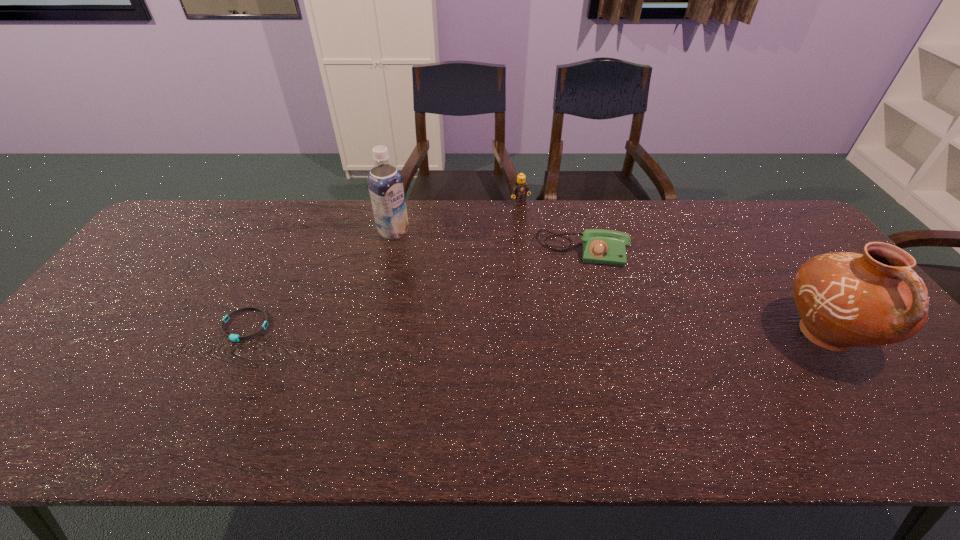
Find the location of a particular element. This screenshot has width=960, height=540. object that is at the near edge is located at coordinates (845, 299).

Where is `object that is at the right edge`? The image size is (960, 540). object that is at the right edge is located at coordinates (845, 299).

Find the location of `object located in the near right corner section of the desktop`. object located in the near right corner section of the desktop is located at coordinates (845, 299).

In the image, there is a desktop. At what (x,y) coordinates should I click in order to perform the action: click on vacant region at the far edge. Please return your answer as a coordinate pair (x, y). The image size is (960, 540). Looking at the image, I should click on (610, 227).

Where is `blank space at the near edge of the desktop`? blank space at the near edge of the desktop is located at coordinates (510, 381).

Where is `vacant area at the left edge of the desktop`? The image size is (960, 540). vacant area at the left edge of the desktop is located at coordinates (63, 348).

Locate an element on the screen. vacant space that is in between the third shortest object and the leftmost object is located at coordinates (383, 265).

At what (x,y) coordinates should I click in order to perform the action: click on free area in between the third shortest object and the rightmost object. Please return your answer as a coordinate pair (x, y). Looking at the image, I should click on (673, 269).

Locate an element on the screen. blank region between the telephone and the pottery is located at coordinates (704, 293).

What are the coordinates of `vacant region between the fourth tallest object and the rightmost object` in the screenshot? It's located at (704, 293).